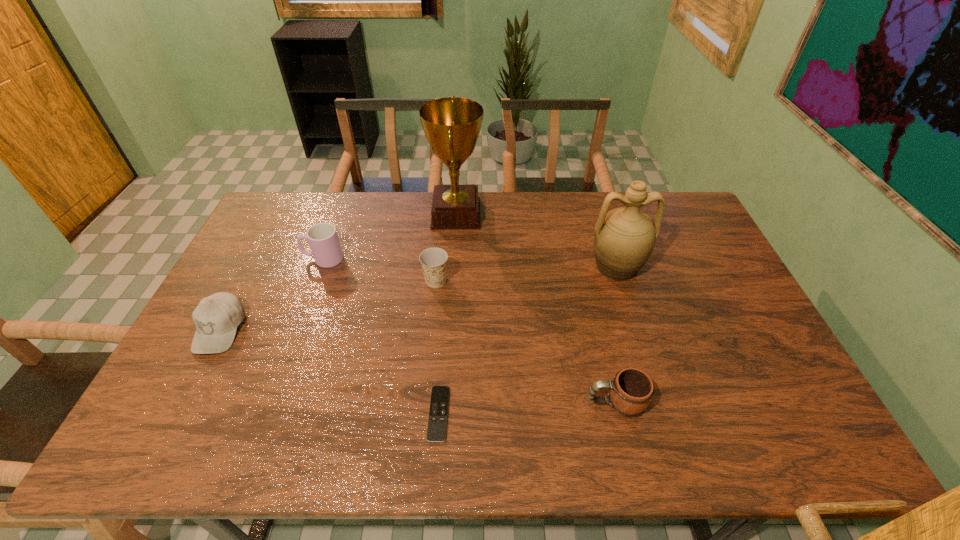
Locate an element on the screen. object at the far edge is located at coordinates (451, 125).

Locate an element on the screen. Image resolution: width=960 pixels, height=540 pixels. mug that is at the near edge is located at coordinates point(631,390).

At what (x,y) coordinates should I click in order to perform the action: click on remote control present at the near edge. Please return your answer as a coordinate pair (x, y). Looking at the image, I should click on (437, 424).

The width and height of the screenshot is (960, 540). Find the location of `object that is at the left edge`. object that is at the left edge is located at coordinates (216, 318).

Image resolution: width=960 pixels, height=540 pixels. Find the location of `vacant space at the far edge of the desktop`. vacant space at the far edge of the desktop is located at coordinates (341, 195).

The width and height of the screenshot is (960, 540). I want to click on vacant space at the near edge of the desktop, so click(x=699, y=422).

Where is `free point at the left edge`? The height and width of the screenshot is (540, 960). free point at the left edge is located at coordinates (203, 387).

The height and width of the screenshot is (540, 960). In the image, there is a desktop. What are the coordinates of `vacant space at the right edge` in the screenshot? It's located at (728, 325).

Find the location of a particular element. This screenshot has height=540, width=960. vacant space at the far right corner of the desktop is located at coordinates (649, 208).

Identify the location of free space between the cup and the Dixie cup. This screenshot has width=960, height=540. (379, 270).